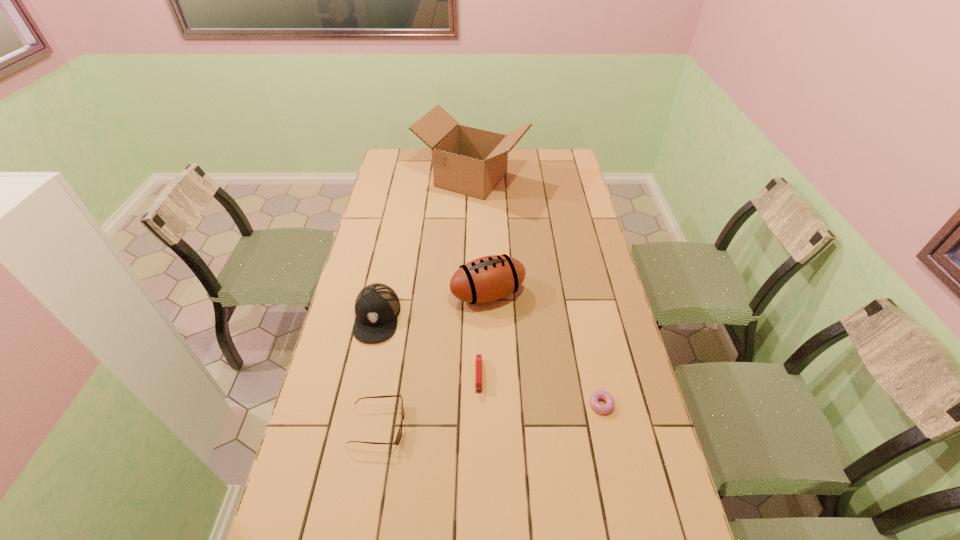
This screenshot has width=960, height=540. What are the coordinates of `free region at the far edge of the desktop` in the screenshot? It's located at (432, 164).

What are the coordinates of `vacant area at the left edge` in the screenshot? It's located at (388, 211).

Locate an element on the screen. This screenshot has width=960, height=540. vacant region at the right edge is located at coordinates (565, 227).

The width and height of the screenshot is (960, 540). I want to click on vacant area that lies between the football (American) and the rightmost object, so click(x=545, y=349).

The height and width of the screenshot is (540, 960). What are the coordinates of `vacant area that lies between the sunglasses and the stapler` in the screenshot? It's located at (428, 400).

Where is `free spot between the sunglasses and the cap`? free spot between the sunglasses and the cap is located at coordinates (377, 372).

Locate an element on the screen. empty space between the third tallest object and the shortest object is located at coordinates (490, 361).

The height and width of the screenshot is (540, 960). I want to click on vacant area that lies between the rightmost object and the stapler, so click(540, 390).

Locate an element on the screen. The width and height of the screenshot is (960, 540). vacant area that lies between the tallest object and the fifth shortest object is located at coordinates (480, 237).

You are a GUI agent. You are given a task and a screenshot of the screen. Output one action in this format:
    pyautogui.click(x=<x>, y=<y>)
    Task: Click on the vacant space in between the fourth shortest object and the sunglasses
    
    Given the screenshot: What is the action you would take?
    coord(377,372)